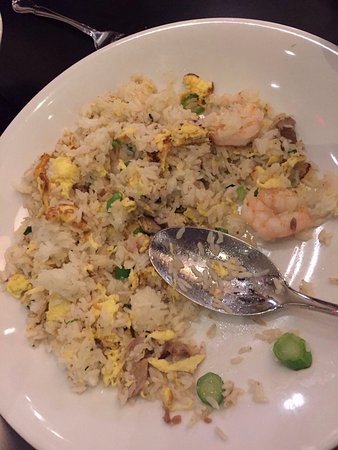
You are a GUI agent. You are given a task and a screenshot of the screen. Output one action in this format:
    pyautogui.click(x=<x>, y=<y>)
    Task: Click on the fork
    This screenshot has height=450, width=338.
    Given the screenshot: What is the action you would take?
    pyautogui.click(x=113, y=35)